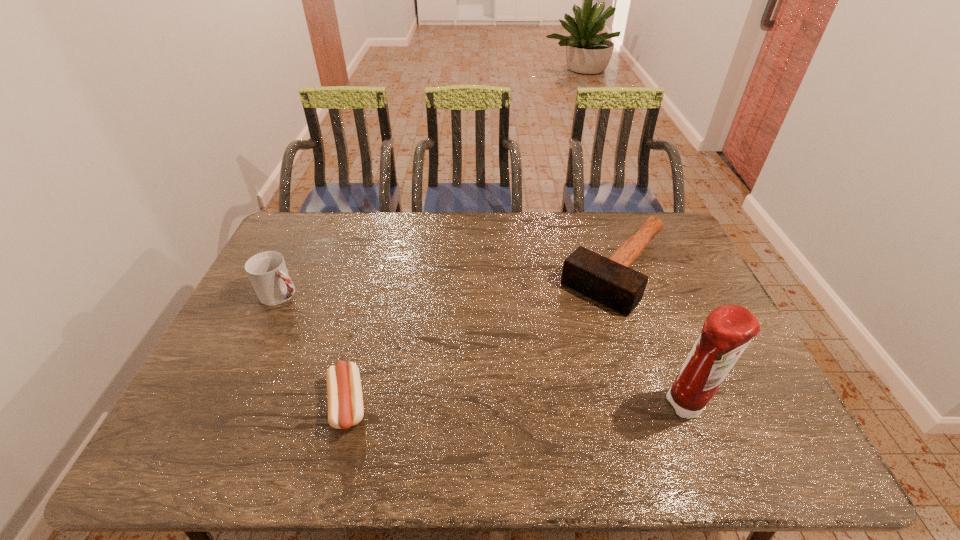
Identify the location of vacant spot on the desktop that is between the sausage and the tallest object and is positioned on the striking face of the second shortest object. (492, 406).

Identify the location of free space on the desktop that is between the sausage and the condiment and is positioned on the side of the leftmost object where the handle is located. (480, 406).